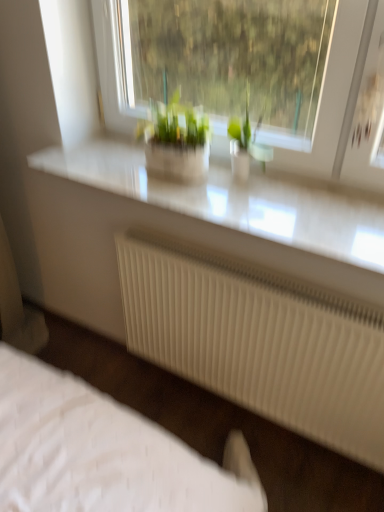
Question: Can you confirm if white ribbed radiator at lower center is thinner than green matte plant at center, the 2th houseplant from the right?

Choices:
 (A) yes
 (B) no

Answer: (A)

Question: Does white ribbed radiator at lower center have a greater height compared to green matte plant at center, which is counted as the first houseplant, starting from the left?

Choices:
 (A) no
 (B) yes

Answer: (B)

Question: Is white ribbed radiator at lower center next to green matte plant at center, the 2th houseplant from the right, and touching it?

Choices:
 (A) no
 (B) yes

Answer: (A)

Question: From the image's perspective, would you say white ribbed radiator at lower center is shown under green matte plant at center, which is counted as the first houseplant, starting from the left?

Choices:
 (A) yes
 (B) no

Answer: (A)

Question: Is there a large distance between white ribbed radiator at lower center and green matte plant at center, which is counted as the first houseplant, starting from the left?

Choices:
 (A) yes
 (B) no

Answer: (B)

Question: Considering their positions, is white quilted bed at lower left located in front of or behind green matte plant at center, which is counted as the first houseplant, starting from the left?

Choices:
 (A) front
 (B) behind

Answer: (B)

Question: Considering the positions of point (49, 452) and point (153, 161), is point (49, 452) closer or farther from the camera than point (153, 161)?

Choices:
 (A) farther
 (B) closer

Answer: (B)

Question: In terms of width, does white quilted bed at lower left look wider or thinner when compared to green matte plant at center, which is counted as the first houseplant, starting from the left?

Choices:
 (A) thin
 (B) wide

Answer: (B)

Question: Is white quilted bed at lower left taller or shorter than green matte plant at center, the 2th houseplant from the right?

Choices:
 (A) tall
 (B) short

Answer: (B)

Question: Which is correct: white glossy counter top at upper center is inside green matte plant at center, the 2th houseplant from the right, or outside of it?

Choices:
 (A) outside
 (B) inside

Answer: (A)

Question: From the image's perspective, is white glossy counter top at upper center above or below green matte plant at center, the 2th houseplant from the right?

Choices:
 (A) below
 (B) above

Answer: (A)

Question: In terms of width, does white glossy counter top at upper center look wider or thinner when compared to green matte plant at center, the 2th houseplant from the right?

Choices:
 (A) thin
 (B) wide

Answer: (B)

Question: In terms of size, does white glossy counter top at upper center appear bigger or smaller than green matte plant at center, the 2th houseplant from the right?

Choices:
 (A) small
 (B) big

Answer: (B)

Question: Considering the positions of green matte plant at center, which is counted as the first houseplant, starting from the left, and green glass vase at center, the 2th houseplant positioned from the left, in the image, is green matte plant at center, which is counted as the first houseplant, starting from the left, wider or thinner than green glass vase at center, the 2th houseplant positioned from the left,?

Choices:
 (A) thin
 (B) wide

Answer: (B)

Question: Considering their positions, is green matte plant at center, the 2th houseplant from the right, located in front of or behind green glass vase at center, which is the first houseplant in right-to-left order?

Choices:
 (A) front
 (B) behind

Answer: (B)